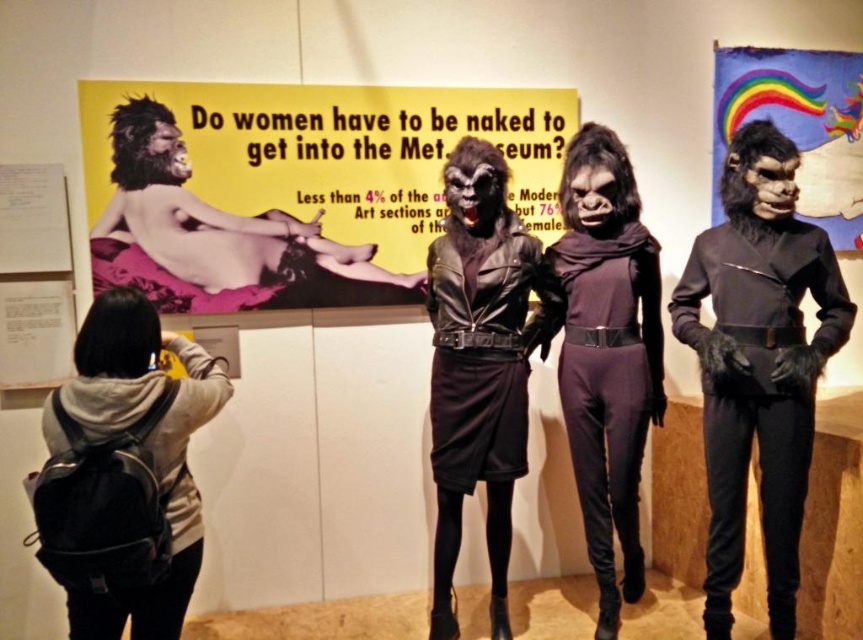
Is purple matte jumpsuit at center shorter than rainbow fabric poster at upper right?

Incorrect, purple matte jumpsuit at center's height does not fall short of rainbow fabric poster at upper right's.

Who is shorter, purple matte jumpsuit at center or rainbow fabric poster at upper right?

Standing shorter between the two is rainbow fabric poster at upper right.

Who is more forward, (x=630, y=592) or (x=744, y=77)?

Point (x=630, y=592) is more forward.

I want to click on purple matte jumpsuit at center, so click(606, 380).

Does matte black gorilla at center come behind black leather dress at center?

Yes, it is.

Does matte black gorilla at center have a larger size compared to black leather dress at center?

Correct, matte black gorilla at center is larger in size than black leather dress at center.

Is point (154, 269) closer to camera compared to point (460, 467)?

No, it is not.

In order to click on matte black gorilla at center in this screenshot , I will do `click(217, 237)`.

This screenshot has width=863, height=640. What do you see at coordinates (758, 364) in the screenshot? I see `matte black suit at center` at bounding box center [758, 364].

Between matte black suit at center and black leather dress at center, which one is positioned higher?

black leather dress at center is above.

Find the location of a particular element. This screenshot has height=640, width=863. matte black suit at center is located at coordinates pos(758,364).